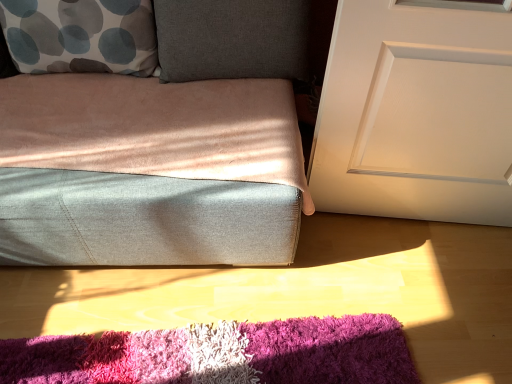
Question: In terms of height, does white matte door at right look taller or shorter compared to shaggy multicolor rug at lower center?

Choices:
 (A) tall
 (B) short

Answer: (A)

Question: Based on their sizes in the image, would you say white matte door at right is bigger or smaller than shaggy multicolor rug at lower center?

Choices:
 (A) big
 (B) small

Answer: (A)

Question: Estimate the real-world distances between objects in this image. Which object is closer to the white with gray and blue circles pillow at upper left?

Choices:
 (A) shaggy multicolor rug at lower center
 (B) dark gray fabric pillow at upper center
 (C) white matte door at right

Answer: (B)

Question: Which object is the farthest from the white with gray and blue circles pillow at upper left?

Choices:
 (A) white matte door at right
 (B) shaggy multicolor rug at lower center
 (C) dark gray fabric pillow at upper center

Answer: (B)